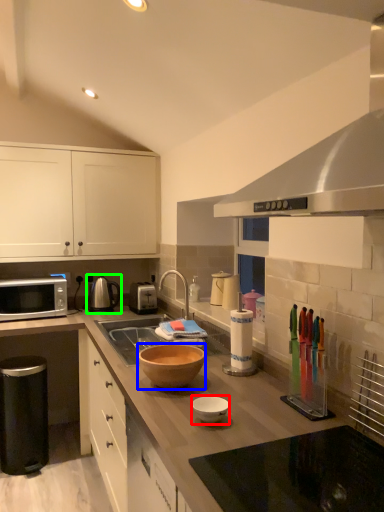
Question: Which object is positioned farthest from bowl (highlighted by a red box)? Select from bowl (highlighted by a blue box) and tea pot (highlighted by a green box).

Choices:
 (A) bowl
 (B) tea pot

Answer: (B)